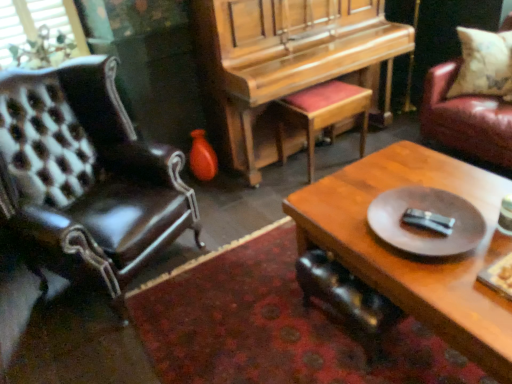
The height and width of the screenshot is (384, 512). Identify the location of vacant space to the right of leather chair at left, the second chair viewed from the right. tap(236, 265).